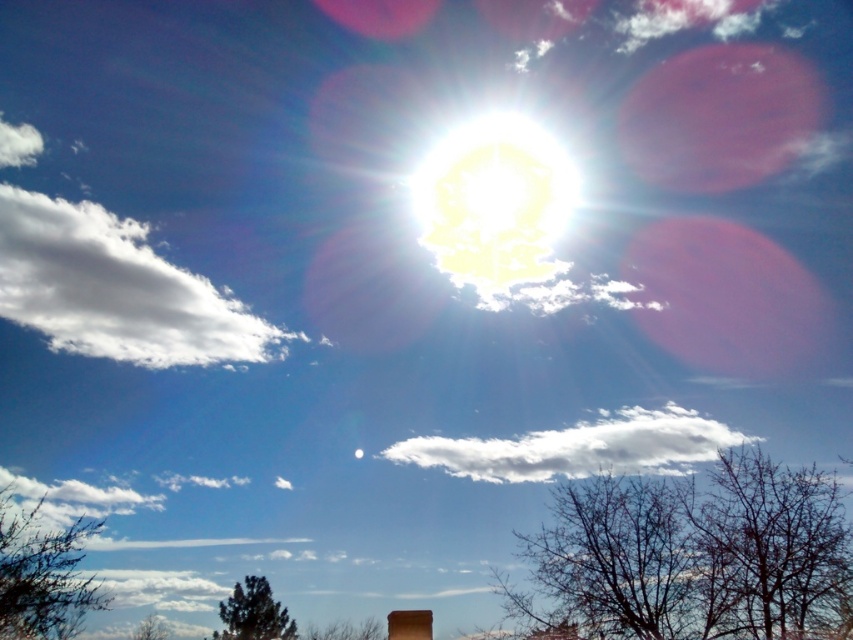
Question: Considering the real-world distances, which object is farthest from the green matte tree at lower left?

Choices:
 (A) white fluffy cloud at lower left
 (B) green matte tree at lower center
 (C) white fluffy cloud at upper left

Answer: (C)

Question: Does bare branches at lower right have a lesser width compared to brown matte chimney at lower center?

Choices:
 (A) no
 (B) yes

Answer: (A)

Question: Is bare branches at lower right smaller than white fluffy cloud at lower left?

Choices:
 (A) yes
 (B) no

Answer: (B)

Question: Estimate the real-world distances between objects in this image. Which object is closer to the white bright at center?

Choices:
 (A) green matte tree at lower center
 (B) green leafy tree at lower left
 (C) bare branches at lower right

Answer: (C)

Question: Which point is closer to the camera?

Choices:
 (A) white fluffy cloud at lower left
 (B) brown matte chimney at lower center
 (C) white bright at center
 (D) white fluffy cloud at upper left

Answer: (B)

Question: Is white fluffy cloud at center below brown matte chimney at lower center?

Choices:
 (A) no
 (B) yes

Answer: (A)